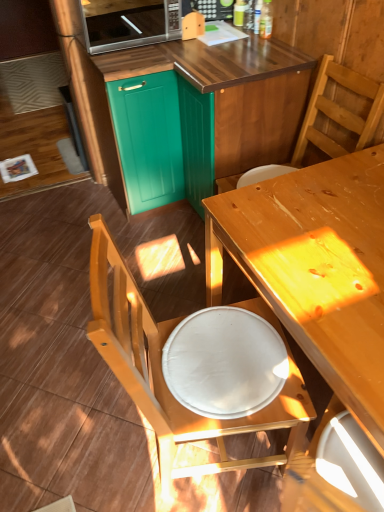
What is the approximate width of white glossy plate at lower center?

white glossy plate at lower center is 14.93 inches wide.

Locate an element on the screen. This screenshot has width=384, height=512. satin silver microwave at upper center is located at coordinates (138, 21).

What do you see at coordinates (148, 139) in the screenshot? The height and width of the screenshot is (512, 384). I see `teal matte cabinet at upper center, positioned as the 1th cabinetry in left-to-right order` at bounding box center [148, 139].

Describe the element at coordinates (339, 110) in the screenshot. I see `wooden chair at upper right, acting as the 2th chair starting from the bottom` at that location.

Identify the location of white glossy plate at lower center. This screenshot has width=384, height=512. (224, 362).

Is teal matte cabinet at upper center, arranged as the second cabinetry when viewed from the right, beside wooden chair at lower left, the second chair in the top-to-bottom sequence?

No, teal matte cabinet at upper center, arranged as the second cabinetry when viewed from the right, is not with wooden chair at lower left, the second chair in the top-to-bottom sequence.

Which is correct: teal matte cabinet at upper center, arranged as the second cabinetry when viewed from the right, is inside wooden chair at lower left, the first chair in the bottom-to-top sequence, or outside of it?

teal matte cabinet at upper center, arranged as the second cabinetry when viewed from the right, is located beyond the bounds of wooden chair at lower left, the first chair in the bottom-to-top sequence.

Who is smaller, teal matte cabinet at upper center, positioned as the 1th cabinetry in left-to-right order, or wooden chair at lower left, the second chair in the top-to-bottom sequence?

Smaller between the two is teal matte cabinet at upper center, positioned as the 1th cabinetry in left-to-right order.

Are wooden table at center and satin silver microwave at upper center beside each other?

There is a gap between wooden table at center and satin silver microwave at upper center.

Find the location of `table in front of the satin silver microwave at upper center`. table in front of the satin silver microwave at upper center is located at coordinates (316, 268).

From the image's perspective, which is below, wooden table at center or satin silver microwave at upper center?

wooden table at center appears lower in the image.

Which object is thinner, wooden table at center or satin silver microwave at upper center?

satin silver microwave at upper center is thinner.

Does point (106, 46) come closer to viewer compared to point (120, 119)?

Yes, it is in front of point (120, 119).

Considering the sizes of objects satin silver microwave at upper center and teal matte cabinet at upper center, positioned as the 1th cabinetry in left-to-right order, in the image provided, who is wider, satin silver microwave at upper center or teal matte cabinet at upper center, positioned as the 1th cabinetry in left-to-right order,?

Wider between the two is teal matte cabinet at upper center, positioned as the 1th cabinetry in left-to-right order.

Considering the relative sizes of satin silver microwave at upper center and teal matte cabinet at upper center, arranged as the second cabinetry when viewed from the right, in the image provided, is satin silver microwave at upper center taller than teal matte cabinet at upper center, arranged as the second cabinetry when viewed from the right,?

Incorrect, the height of satin silver microwave at upper center is not larger of that of teal matte cabinet at upper center, arranged as the second cabinetry when viewed from the right.

Considering the relative positions of teal wood cabinet at upper center, marked as the 2th cabinetry in a left-to-right arrangement, and satin silver microwave at upper center in the image provided, is teal wood cabinet at upper center, marked as the 2th cabinetry in a left-to-right arrangement, to the left of satin silver microwave at upper center from the viewer's perspective?

In fact, teal wood cabinet at upper center, marked as the 2th cabinetry in a left-to-right arrangement, is to the right of satin silver microwave at upper center.

What are the coordinates of `cabinetry lying in front of the satin silver microwave at upper center` in the screenshot? It's located at (201, 113).

From the image's perspective, is teal wood cabinet at upper center, marked as the 1th cabinetry in a right-to-left arrangement, under satin silver microwave at upper center?

Correct, teal wood cabinet at upper center, marked as the 1th cabinetry in a right-to-left arrangement, appears lower than satin silver microwave at upper center in the image.

From the image's perspective, which is above, wooden chair at lower left, the second chair in the top-to-bottom sequence, or wooden table at center?

wooden table at center appears higher in the image.

Considering the sizes of objects wooden chair at lower left, the first chair in the bottom-to-top sequence, and wooden table at center in the image provided, who is shorter, wooden chair at lower left, the first chair in the bottom-to-top sequence, or wooden table at center?

Standing shorter between the two is wooden table at center.

Is point (107, 268) positioned in front of point (267, 241)?

Yes, it is in front of point (267, 241).

Considering the sizes of objects wooden chair at upper right, acting as the 2th chair starting from the bottom, and teal wood cabinet at upper center, marked as the 1th cabinetry in a right-to-left arrangement, in the image provided, who is smaller, wooden chair at upper right, acting as the 2th chair starting from the bottom, or teal wood cabinet at upper center, marked as the 1th cabinetry in a right-to-left arrangement,?

wooden chair at upper right, acting as the 2th chair starting from the bottom, is smaller.

Is wooden chair at upper right, arranged as the first chair when viewed from the top, to the left or to the right of teal wood cabinet at upper center, marked as the 2th cabinetry in a left-to-right arrangement, in the image?

wooden chair at upper right, arranged as the first chair when viewed from the top, is positioned on teal wood cabinet at upper center, marked as the 2th cabinetry in a left-to-right arrangement,'s right side.

Does wooden chair at upper right, acting as the 2th chair starting from the bottom, come in front of teal wood cabinet at upper center, marked as the 2th cabinetry in a left-to-right arrangement?

Yes, the depth of wooden chair at upper right, acting as the 2th chair starting from the bottom, is less than that of teal wood cabinet at upper center, marked as the 2th cabinetry in a left-to-right arrangement.

Can you confirm if white glossy plate at lower center is positioned to the left of satin silver microwave at upper center?

No, white glossy plate at lower center is not to the left of satin silver microwave at upper center.

Is white glossy plate at lower center shorter than satin silver microwave at upper center?

Correct, white glossy plate at lower center is not as tall as satin silver microwave at upper center.

Which is correct: white glossy plate at lower center is inside satin silver microwave at upper center, or outside of it?

white glossy plate at lower center is not enclosed by satin silver microwave at upper center.

The width and height of the screenshot is (384, 512). In order to click on the 2nd cabinetry above the wooden chair at lower left, the second chair in the top-to-bottom sequence (from the image's perspective) in this screenshot , I will do `click(148, 139)`.

I want to click on table beneath the satin silver microwave at upper center (from a real-world perspective), so click(x=316, y=268).

When comparing their distances from wooden chair at upper right, acting as the 2th chair starting from the bottom, does teal wood cabinet at upper center, marked as the 2th cabinetry in a left-to-right arrangement, or satin silver microwave at upper center seem further?

Based on the image, satin silver microwave at upper center appears to be further to wooden chair at upper right, acting as the 2th chair starting from the bottom.

Based on the photo, from the image, which object appears to be farther from satin silver microwave at upper center, white glossy plate at lower center or wooden table at center?

Based on the image, white glossy plate at lower center appears to be further to satin silver microwave at upper center.

Considering their positions, is wooden chair at lower left, the first chair in the bottom-to-top sequence, positioned closer to wooden chair at upper right, arranged as the first chair when viewed from the top, than teal wood cabinet at upper center, marked as the 1th cabinetry in a right-to-left arrangement?

Among the two, teal wood cabinet at upper center, marked as the 1th cabinetry in a right-to-left arrangement, is located nearer to wooden chair at upper right, arranged as the first chair when viewed from the top.

When comparing their distances from satin silver microwave at upper center, does wooden table at center or teal wood cabinet at upper center, marked as the 1th cabinetry in a right-to-left arrangement, seem further?

Based on the image, wooden table at center appears to be further to satin silver microwave at upper center.

Estimate the real-world distances between objects in this image. Which object is closer to satin silver microwave at upper center, wooden table at center or wooden chair at upper right, arranged as the first chair when viewed from the top?

wooden chair at upper right, arranged as the first chair when viewed from the top, is positioned closer to the anchor satin silver microwave at upper center.

When comparing their distances from wooden chair at upper right, acting as the 2th chair starting from the bottom, does wooden table at center or wooden chair at lower left, the second chair in the top-to-bottom sequence, seem further?

wooden chair at lower left, the second chair in the top-to-bottom sequence, is positioned further to the anchor wooden chair at upper right, acting as the 2th chair starting from the bottom.

Estimate the real-world distances between objects in this image. Which object is closer to satin silver microwave at upper center, teal wood cabinet at upper center, marked as the 2th cabinetry in a left-to-right arrangement, or white glossy plate at lower center?

Among the two, teal wood cabinet at upper center, marked as the 2th cabinetry in a left-to-right arrangement, is located nearer to satin silver microwave at upper center.

When comparing their distances from wooden chair at lower left, the second chair in the top-to-bottom sequence, does wooden table at center or white glossy plate at lower center seem further?

The object further to wooden chair at lower left, the second chair in the top-to-bottom sequence, is wooden table at center.

Where is `table that lies between teal wood cabinet at upper center, marked as the 2th cabinetry in a left-to-right arrangement, and white glossy plate at lower center from top to bottom`? This screenshot has height=512, width=384. table that lies between teal wood cabinet at upper center, marked as the 2th cabinetry in a left-to-right arrangement, and white glossy plate at lower center from top to bottom is located at coordinates (316, 268).

Find the location of `round table between satin silver microwave at upper center and wooden chair at lower left, the first chair in the bottom-to-top sequence, from top to bottom`. round table between satin silver microwave at upper center and wooden chair at lower left, the first chair in the bottom-to-top sequence, from top to bottom is located at coordinates (224, 362).

Locate an element on the screen. Image resolution: width=384 pixels, height=512 pixels. cabinetry situated between teal matte cabinet at upper center, positioned as the 1th cabinetry in left-to-right order, and wooden chair at upper right, acting as the 2th chair starting from the bottom, from left to right is located at coordinates (201, 113).

Locate an element on the screen. table between teal matte cabinet at upper center, arranged as the second cabinetry when viewed from the right, and white glossy plate at lower center from top to bottom is located at coordinates (316, 268).